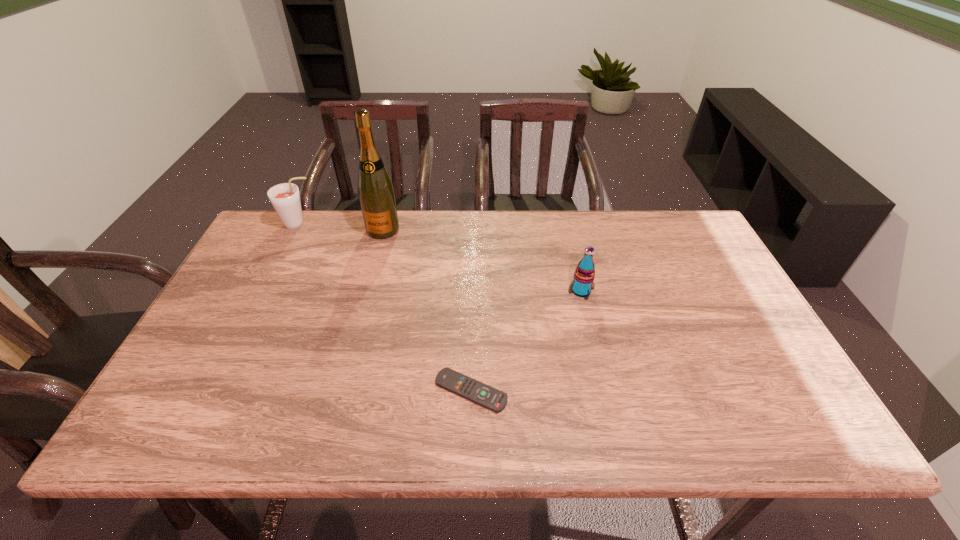
Identify the location of free spot that satisfies the following two spatial constraints: 1. on the front-facing side of the third object from right to left; 2. on the right side of the shortest object. The width and height of the screenshot is (960, 540). (340, 391).

Where is `vacant area in the image that satisfies the following two spatial constraints: 1. on the front-facing side of the third farthest object; 2. on the right side of the tallest object`? vacant area in the image that satisfies the following two spatial constraints: 1. on the front-facing side of the third farthest object; 2. on the right side of the tallest object is located at coordinates (367, 291).

The height and width of the screenshot is (540, 960). I want to click on free spot that satisfies the following two spatial constraints: 1. on the front-facing side of the second nearest object; 2. on the left side of the third object from right to left, so click(367, 291).

Image resolution: width=960 pixels, height=540 pixels. What are the coordinates of `free space that satisfies the following two spatial constraints: 1. on the front-facing side of the second nearest object; 2. on the left side of the second object from left to right` in the screenshot? It's located at 367,291.